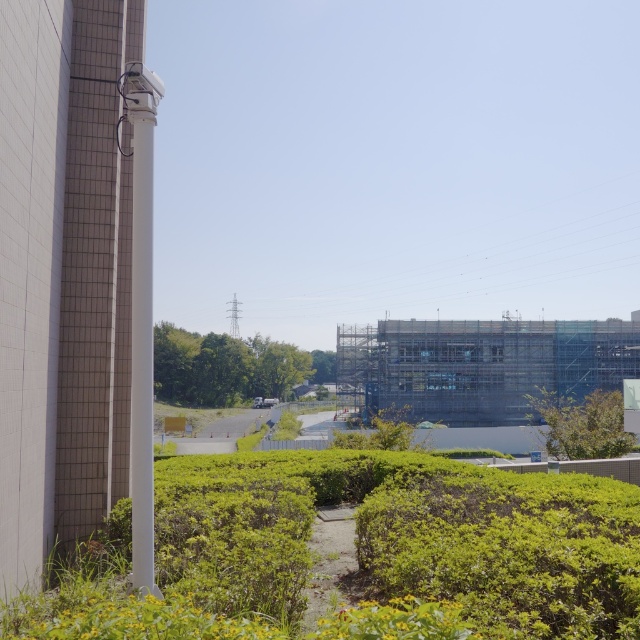
Question: Does green leafy bush at center have a greater width compared to green leafy shrubs at center?

Choices:
 (A) yes
 (B) no

Answer: (B)

Question: Can you confirm if green leafy bush at center is smaller than green leafy shrubs at center?

Choices:
 (A) yes
 (B) no

Answer: (A)

Question: Which of the following is the closest to the observer?

Choices:
 (A) green leafy bush at center
 (B) green leafy shrubs at center

Answer: (A)

Question: Among these objects, which one is nearest to the camera?

Choices:
 (A) green leafy bush at center
 (B) green leafy shrubs at center

Answer: (A)

Question: Which of the following is the closest to the observer?

Choices:
 (A) (465, 536)
 (B) (292, 355)

Answer: (A)

Question: Can you confirm if green leafy bush at center is wider than green leafy shrubs at center?

Choices:
 (A) yes
 (B) no

Answer: (B)